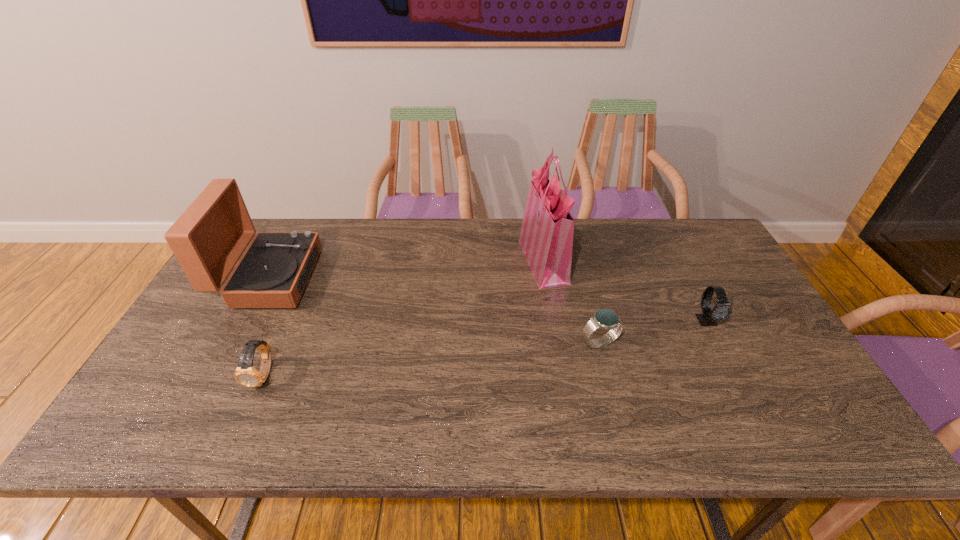
The width and height of the screenshot is (960, 540). I want to click on shopping bag, so click(546, 237).

Find the location of a particular element. The image size is (960, 540). the second tallest object is located at coordinates (208, 239).

Where is `the rightmost object`? The width and height of the screenshot is (960, 540). the rightmost object is located at coordinates (722, 310).

The image size is (960, 540). I want to click on the farthest watch, so pyautogui.click(x=722, y=310).

I want to click on the nearest object, so click(245, 374).

Where is `the leftmost watch`? the leftmost watch is located at coordinates click(245, 374).

Identify the location of the second watch from left to right. (606, 319).

The width and height of the screenshot is (960, 540). Identify the location of the fourth farthest object. (606, 319).

Find the location of a particular element. This screenshot has height=540, width=960. free spot located on the back of the tallest object is located at coordinates 538,227.

Where is `vacant position located 0.160m on the face of the phonograph record`? This screenshot has width=960, height=540. vacant position located 0.160m on the face of the phonograph record is located at coordinates (365, 278).